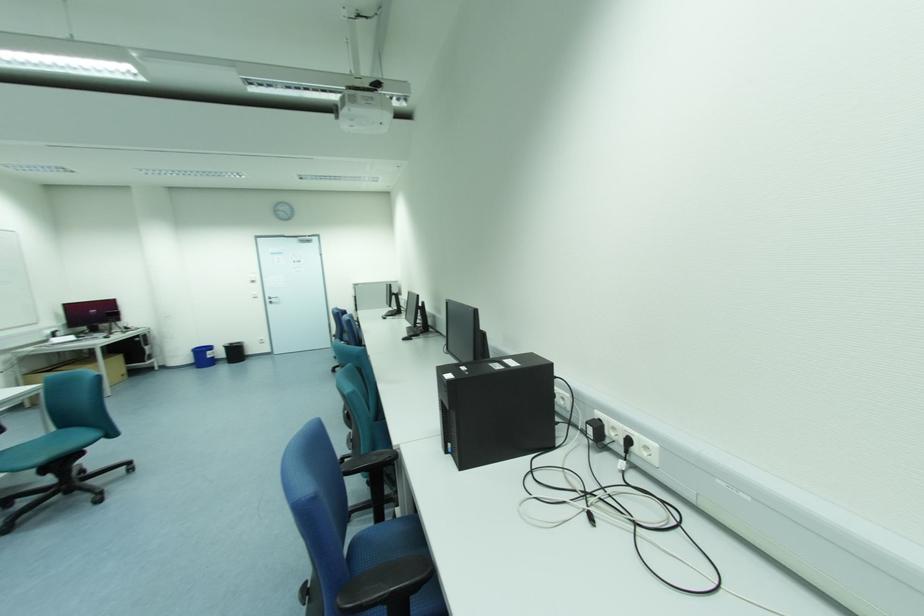
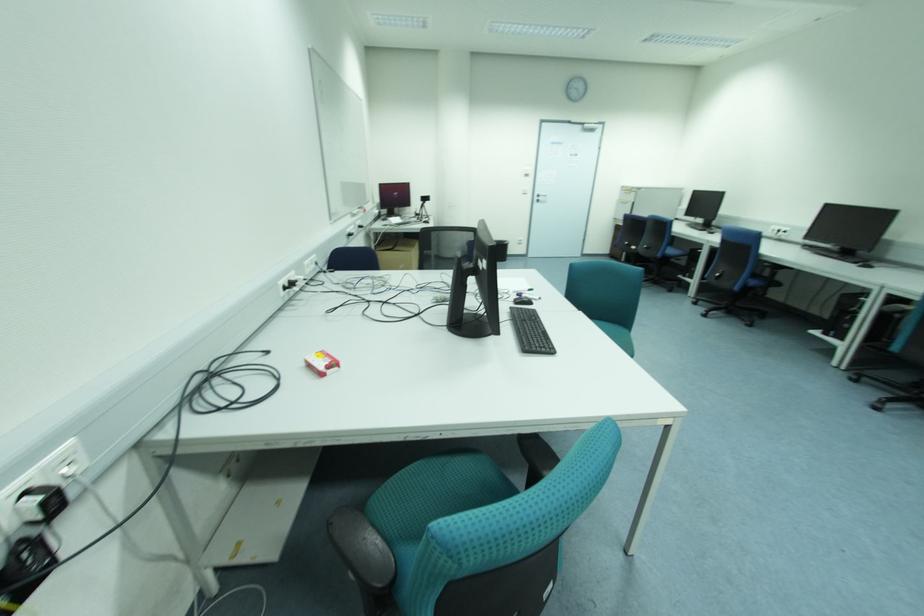
Question: What movement of the cameraman would produce the second image?

Choices:
 (A) Left
 (B) Right
 (C) Forward
 (D) Backward

Answer: (A)